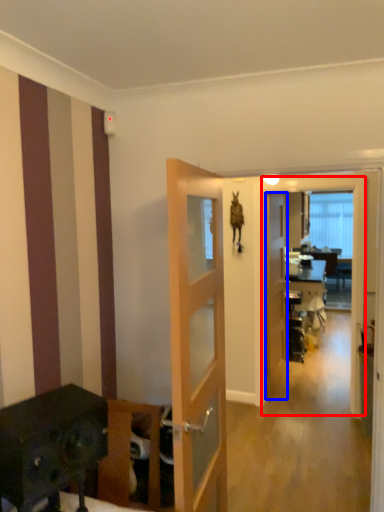
Question: Which of the following is the closest to the observer, screen door (highlighted by a red box) or door (highlighted by a blue box)?

Choices:
 (A) screen door
 (B) door

Answer: (A)